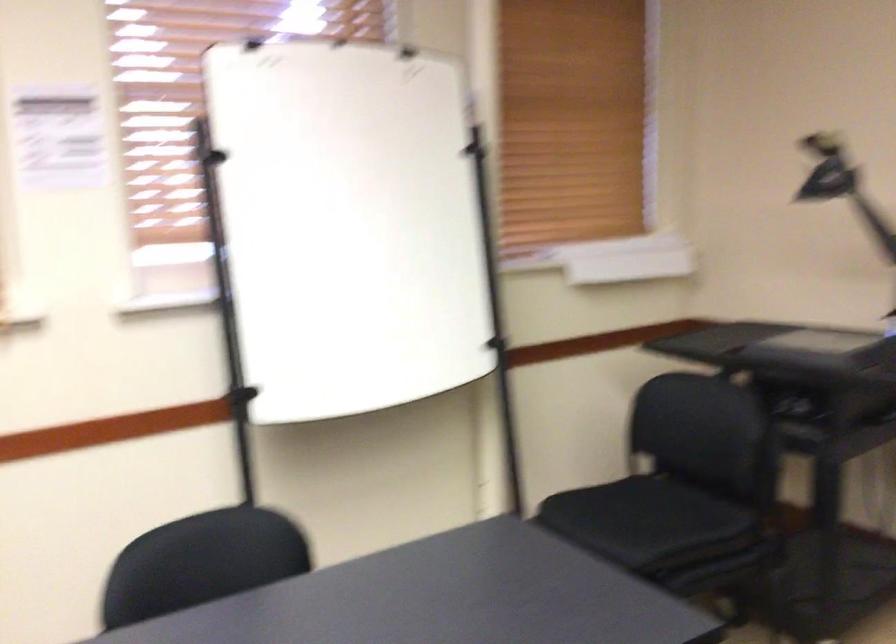
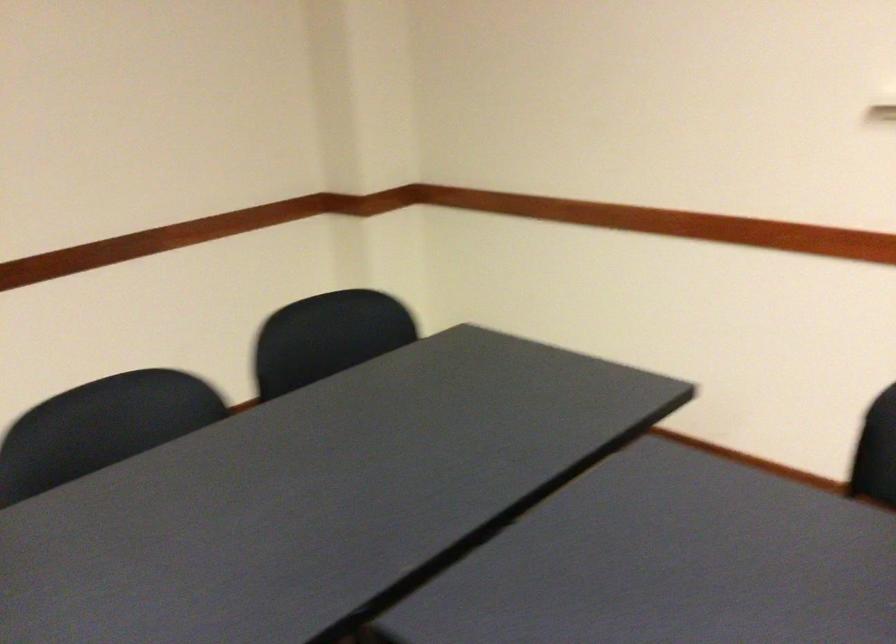
Consider the image. How did the camera likely rotate?

The camera's rotation is toward left-down.